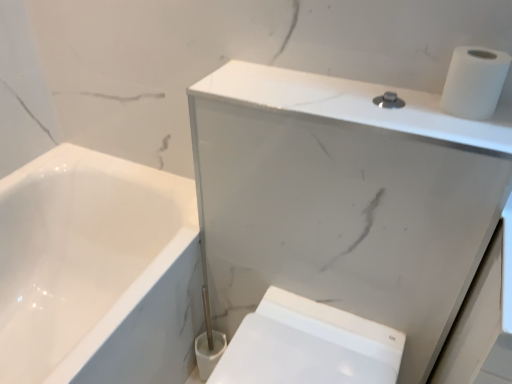
You are a GUI agent. You are given a task and a screenshot of the screen. Output one action in this format:
    pyautogui.click(x=<x>, y=<y>)
    Task: Click on the free location above white glossy bidet at lower right (from a real-world perspective)
    This screenshot has width=512, height=384.
    Given the screenshot: What is the action you would take?
    pyautogui.click(x=293, y=357)